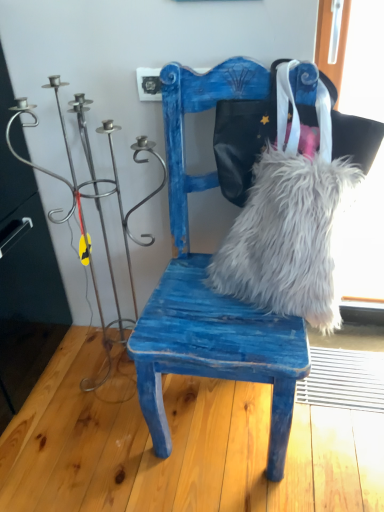
Question: Visually, is metallic wire candle holder at left positioned to the left or to the right of white fluffy fur at center?

Choices:
 (A) left
 (B) right

Answer: (A)

Question: Looking at their shapes, would you say metallic wire candle holder at left is wider or thinner than white fluffy fur at center?

Choices:
 (A) thin
 (B) wide

Answer: (B)

Question: Based on their relative distances, which object is nearer to the metallic wire candle holder at left?

Choices:
 (A) blue distressed wood chair at center
 (B) white fluffy fur at center

Answer: (A)

Question: Based on their relative distances, which object is nearer to the blue distressed wood chair at center?

Choices:
 (A) white fluffy fur at center
 (B) metallic wire candle holder at left

Answer: (A)